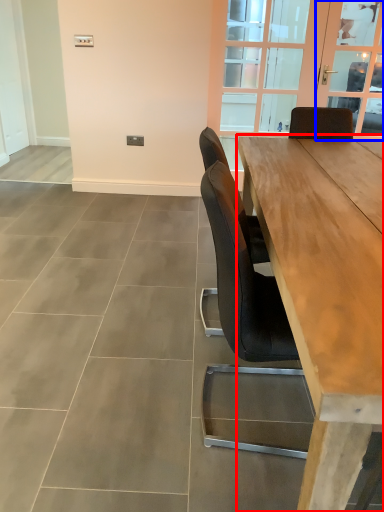
Question: Which of the following is the closest to the observer, table (highlighted by a red box) or window screen (highlighted by a blue box)?

Choices:
 (A) table
 (B) window screen

Answer: (A)